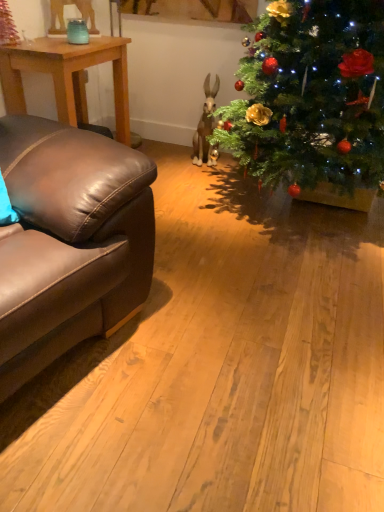
The width and height of the screenshot is (384, 512). Describe the element at coordinates (70, 242) in the screenshot. I see `brown leather couch at left` at that location.

Measure the distance between point [112,274] and camera.

Point [112,274] is 4.43 feet away from camera.

Find the location of a particular element. brown leather couch at left is located at coordinates (70, 242).

Measure the distance between point [61,83] and camera.

Point [61,83] and camera are 2.22 meters apart.

What do you see at coordinates (67, 76) in the screenshot? This screenshot has width=384, height=512. I see `light brown wooden table at left` at bounding box center [67, 76].

You are a GUI agent. You are given a task and a screenshot of the screen. Output one action in this format:
    pyautogui.click(x=<x>, y=<y>)
    Task: Click on the light brown wooden table at left
    The width and height of the screenshot is (384, 512).
    Given the screenshot: What is the action you would take?
    pyautogui.click(x=67, y=76)

What are the coordinates of `brown leather couch at left` in the screenshot? It's located at (70, 242).

Between brown leather couch at left and light brown wooden table at left, which one appears on the left side from the viewer's perspective?

light brown wooden table at left.

Considering the relative positions of brown leather couch at left and light brown wooden table at left in the image provided, is brown leather couch at left behind light brown wooden table at left?

That is False.

Is point (79, 269) closer to viewer compared to point (122, 132)?

Yes, point (79, 269) is in front of point (122, 132).

From the image's perspective, between brown leather couch at left and light brown wooden table at left, which one is located above?

From the image's view, light brown wooden table at left is above.

From a real-world perspective, is brown leather couch at left above or below light brown wooden table at left?

From a real-world perspective, brown leather couch at left is physically above light brown wooden table at left.

Which object is thinner, brown leather couch at left or light brown wooden table at left?

With smaller width is light brown wooden table at left.

From their relative heights in the image, would you say brown leather couch at left is taller or shorter than light brown wooden table at left?

brown leather couch at left is taller than light brown wooden table at left.

Which of these two, brown leather couch at left or light brown wooden table at left, is bigger?

brown leather couch at left is bigger.

Is light brown wooden table at left a part of brown leather couch at left?

No, light brown wooden table at left is located outside of brown leather couch at left.

Does brown leather couch at left touch light brown wooden table at left?

No, brown leather couch at left is not making contact with light brown wooden table at left.

Does brown leather couch at left turn towards light brown wooden table at left?

No, brown leather couch at left is not oriented towards light brown wooden table at left.

How many degrees apart are the facing directions of brown leather couch at left and light brown wooden table at left?

There is a 12.6-degree angle between the facing directions of brown leather couch at left and light brown wooden table at left.

At what (x,y) coordinates should I click in order to perform the action: click on table above the brown leather couch at left (from the image's perspective). Please return your answer as a coordinate pair (x, y). Looking at the image, I should click on (67, 76).

Does light brown wooden table at left appear on the right side of brown leather couch at left?

No.

Is the depth of light brown wooden table at left less than that of brown leather couch at left?

No, light brown wooden table at left is further to the viewer.

Does point (24, 62) lie in front of point (76, 245)?

No, it is not.

From the image's perspective, which object appears higher, light brown wooden table at left or brown leather couch at left?

light brown wooden table at left.

From a real-world perspective, is light brown wooden table at left positioned under brown leather couch at left based on gravity?

Yes, from a real-world perspective, light brown wooden table at left is below brown leather couch at left.

Consider the image. Considering the sizes of objects light brown wooden table at left and brown leather couch at left in the image provided, who is wider, light brown wooden table at left or brown leather couch at left?

With larger width is brown leather couch at left.

Who is shorter, light brown wooden table at left or brown leather couch at left?

light brown wooden table at left.

Based on their sizes in the image, would you say light brown wooden table at left is bigger or smaller than brown leather couch at left?

Considering their sizes, light brown wooden table at left takes up less space than brown leather couch at left.

Choose the correct answer: Is light brown wooden table at left inside brown leather couch at left or outside it?

light brown wooden table at left is not enclosed by brown leather couch at left.

Is light brown wooden table at left in contact with brown leather couch at left?

No.

Consider the image. Is brown leather couch at left at the back of light brown wooden table at left?

No, brown leather couch at left is not at the back of light brown wooden table at left.

What's the angular difference between light brown wooden table at left and brown leather couch at left's facing directions?

The facing directions of light brown wooden table at left and brown leather couch at left are 12.6 degrees apart.

I want to click on table below the brown leather couch at left (from a real-world perspective), so coord(67,76).

Where is `table beneath the brown leather couch at left (from a real-world perspective)`? table beneath the brown leather couch at left (from a real-world perspective) is located at coordinates 67,76.

This screenshot has width=384, height=512. What are the coordinates of `table located behind the brown leather couch at left` in the screenshot? It's located at (67, 76).